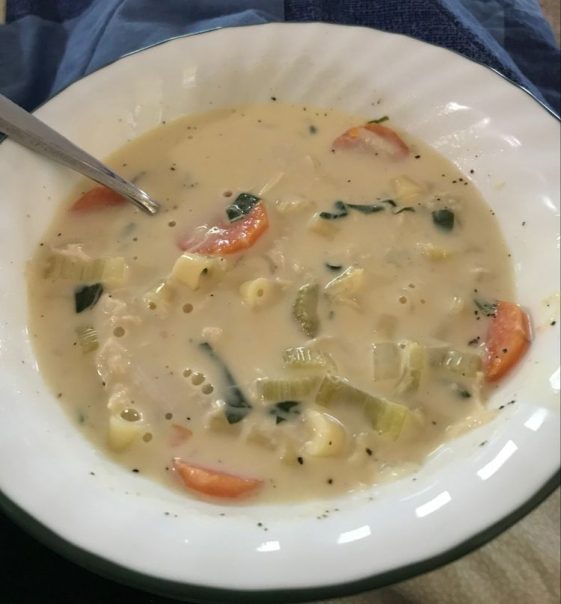
I want to click on spoon handle, so click(55, 146).